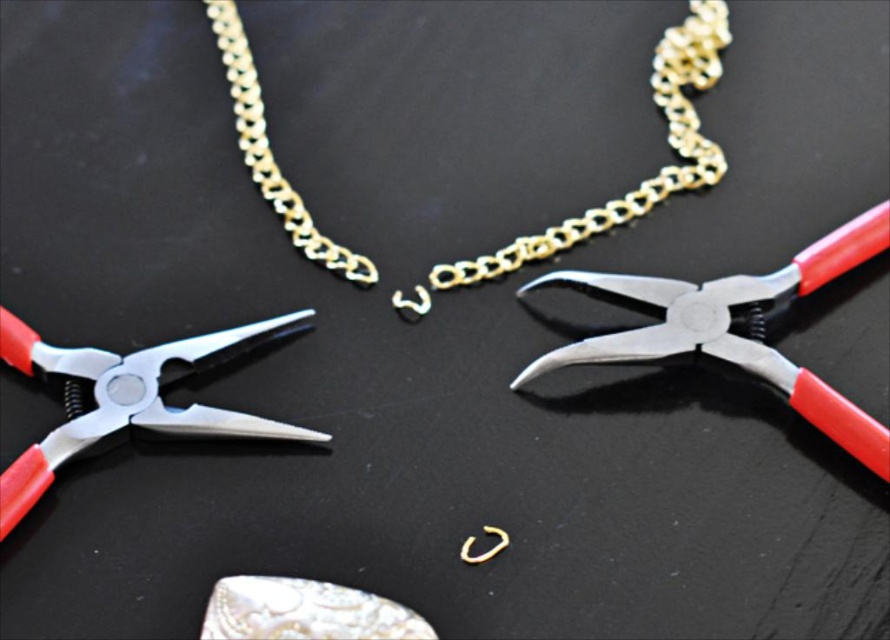
Question: Is metallic silver pliers at center thinner than metallic red-handled pliers at center-left?

Choices:
 (A) no
 (B) yes

Answer: (A)

Question: Observing the image, what is the correct spatial positioning of metallic silver pliers at center in reference to metallic red-handled pliers at center-left?

Choices:
 (A) below
 (B) above

Answer: (B)

Question: Where is gold shiny chain at center located in relation to metallic silver pliers at center in the image?

Choices:
 (A) below
 (B) above

Answer: (B)

Question: Which point is farther to the camera?

Choices:
 (A) (268, 200)
 (B) (30, 362)
 (C) (807, 396)

Answer: (A)

Question: Which point appears farthest from the camera in this image?

Choices:
 (A) (61, 360)
 (B) (678, 93)
 (C) (778, 358)

Answer: (B)

Question: Estimate the real-world distances between objects in this image. Which object is farther from the metallic red-handled pliers at center-left?

Choices:
 (A) gold shiny chain at center
 (B) metallic silver pliers at center

Answer: (B)